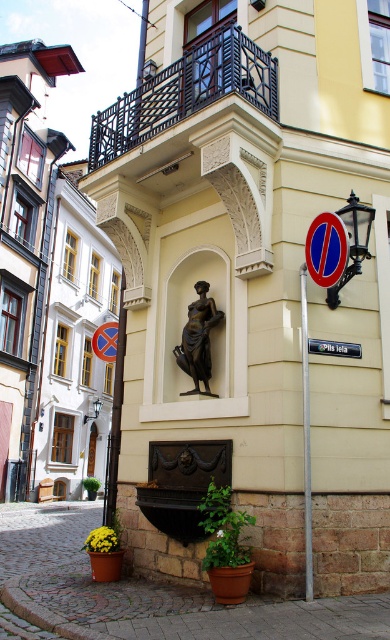
Measure the distance between point (x=209, y=371) and camera.

Point (x=209, y=371) is 7.36 meters away from camera.

Can you confirm if bronze statue at center is taller than blue plastic sign at center?

Yes, bronze statue at center is taller than blue plastic sign at center.

Measure the distance between bronze statue at center and camera.

They are 7.20 meters apart.

Locate an element on the screen. bronze statue at center is located at coordinates (198, 340).

In the scene shown: Is brushed metal pole at center wider than blue plastic sign at center?

No, brushed metal pole at center is not wider than blue plastic sign at center.

Is brushed metal pole at center shorter than blue plastic sign at center?

No.

Which is behind, point (306, 492) or point (349, 355)?

Positioned behind is point (349, 355).

This screenshot has width=390, height=640. In order to click on brushed metal pole at center in this screenshot , I will do `click(306, 436)`.

Can you confirm if bronze statue at center is positioned below brushed metal pole at center?

No, bronze statue at center is not below brushed metal pole at center.

Does point (207, 326) come behind point (306, 444)?

That is True.

Does point (203, 324) come in front of point (306, 554)?

No, it is behind (306, 554).

Find the location of `bronze statue at center`. bronze statue at center is located at coordinates (198, 340).